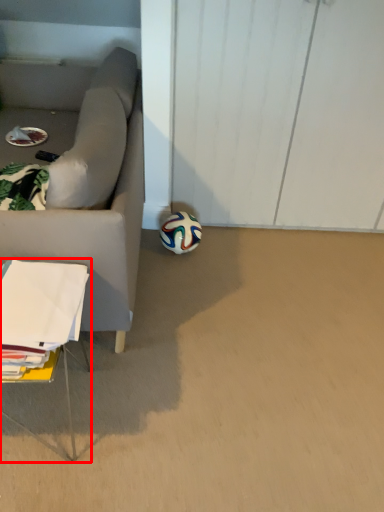
Question: Considering the relative positions of table (annotated by the red box) and football in the image provided, where is table (annotated by the red box) located with respect to the staircase?

Choices:
 (A) right
 (B) left

Answer: (B)